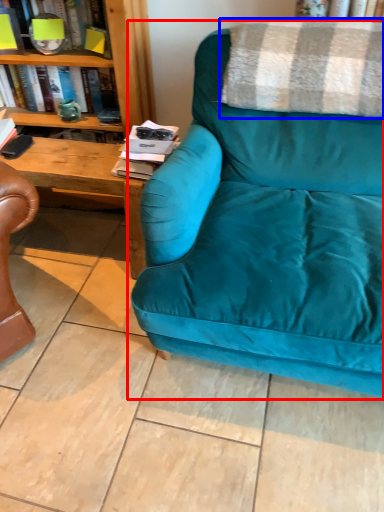
Question: Which point is further to the camera, studio couch (highlighted by a red box) or blanket (highlighted by a blue box)?

Choices:
 (A) studio couch
 (B) blanket

Answer: (B)